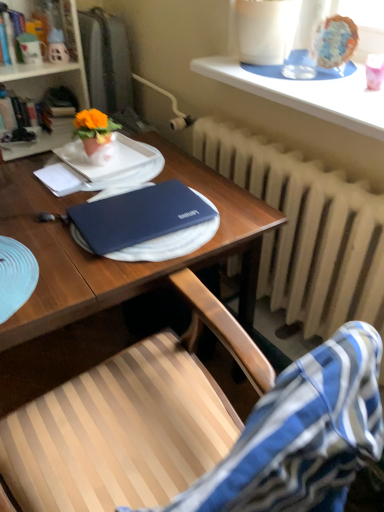
Find the location of a particular element. The width and height of the screenshot is (384, 512). vacant area that lies in front of white paper at left is located at coordinates tap(39, 210).